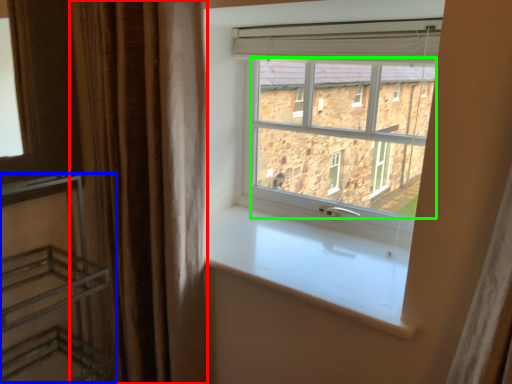
Question: Which object is the closest to the curtain (highlighted by a red box)? Choose among these: shelf (highlighted by a blue box) or window screen (highlighted by a green box).

Choices:
 (A) shelf
 (B) window screen

Answer: (A)